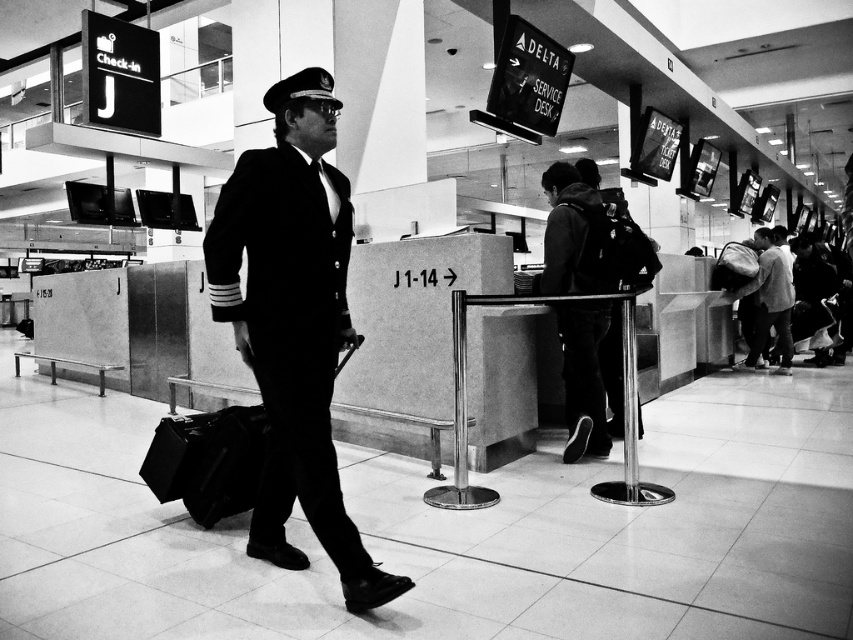
Does dark gray hoodie at center have a smaller size compared to light gray fabric backpack at center?

Yes, dark gray hoodie at center is smaller than light gray fabric backpack at center.

Is dark gray hoodie at center bigger than light gray fabric backpack at center?

Incorrect, dark gray hoodie at center is not larger than light gray fabric backpack at center.

Describe the element at coordinates (572, 234) in the screenshot. I see `dark gray hoodie at center` at that location.

Where is `dark gray hoodie at center`? The height and width of the screenshot is (640, 853). dark gray hoodie at center is located at coordinates (572, 234).

Is velvet black uniform at center wider than light gray fabric backpack at center?

In fact, velvet black uniform at center might be narrower than light gray fabric backpack at center.

Who is more forward, (x=235, y=192) or (x=788, y=326)?

Point (x=235, y=192) is in front.

I want to click on velvet black uniform at center, so click(x=294, y=323).

Is velvet black uniform at center to the right of dark gray hoodie at center from the viewer's perspective?

No, velvet black uniform at center is not to the right of dark gray hoodie at center.

Identify the location of velvet black uniform at center. This screenshot has width=853, height=640. (294, 323).